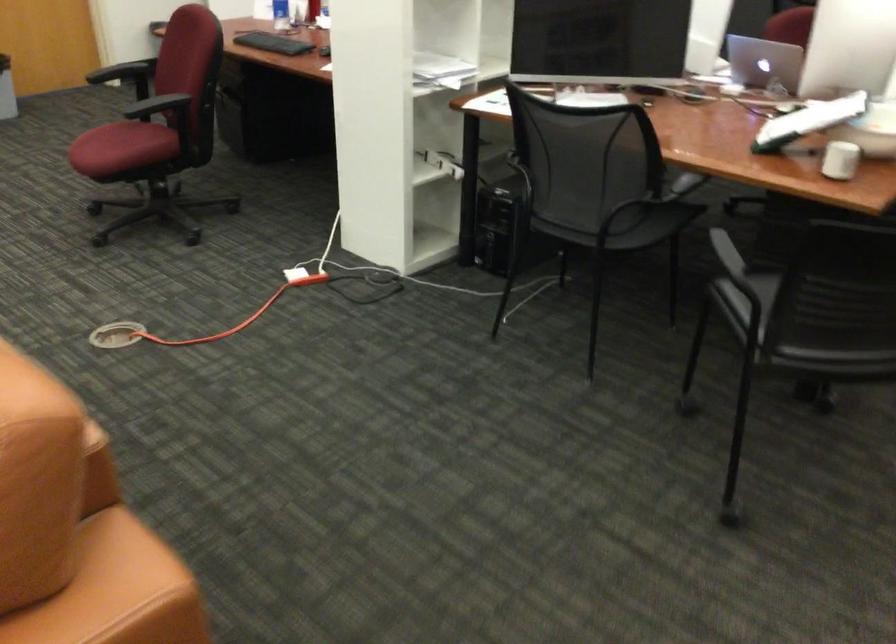
What do you see at coordinates (135, 582) in the screenshot?
I see `a brown sofa sitting surface` at bounding box center [135, 582].